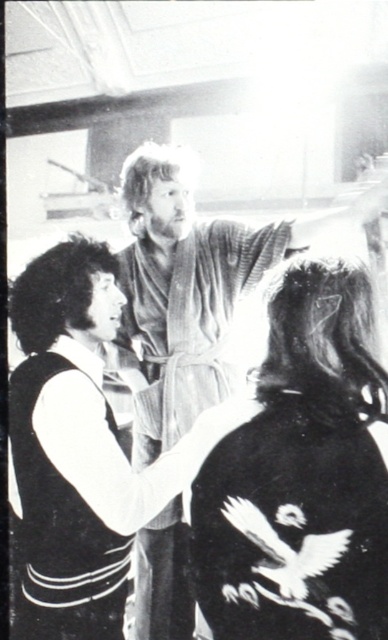
Locate an element on the screen. The width and height of the screenshot is (388, 640). textured cotton robe at center is located at coordinates (188, 321).

Can you confirm if textured cotton robe at center is positioned below striped fabric robe at center?

No, textured cotton robe at center is not below striped fabric robe at center.

Describe the element at coordinates (188, 321) in the screenshot. I see `textured cotton robe at center` at that location.

Locate an element on the screen. textured cotton robe at center is located at coordinates (188, 321).

Is striped fabric robe at center closer to camera compared to dark textured hair at center?

No, striped fabric robe at center is behind dark textured hair at center.

Which is above, striped fabric robe at center or dark textured hair at center?

dark textured hair at center is higher up.

Who is more distant from viewer, (122, 614) or (273, 381)?

Point (122, 614)

Where is `striped fabric robe at center`? The width and height of the screenshot is (388, 640). striped fabric robe at center is located at coordinates (57, 520).

Is black matte jacket at center taller than curly hair at left?

Indeed, black matte jacket at center has a greater height compared to curly hair at left.

Is black matte jacket at center closer to the viewer compared to curly hair at left?

Yes, it is.

The height and width of the screenshot is (640, 388). I want to click on black matte jacket at center, so tap(301, 477).

Find the location of `black matte jacket at center`. black matte jacket at center is located at coordinates (301, 477).